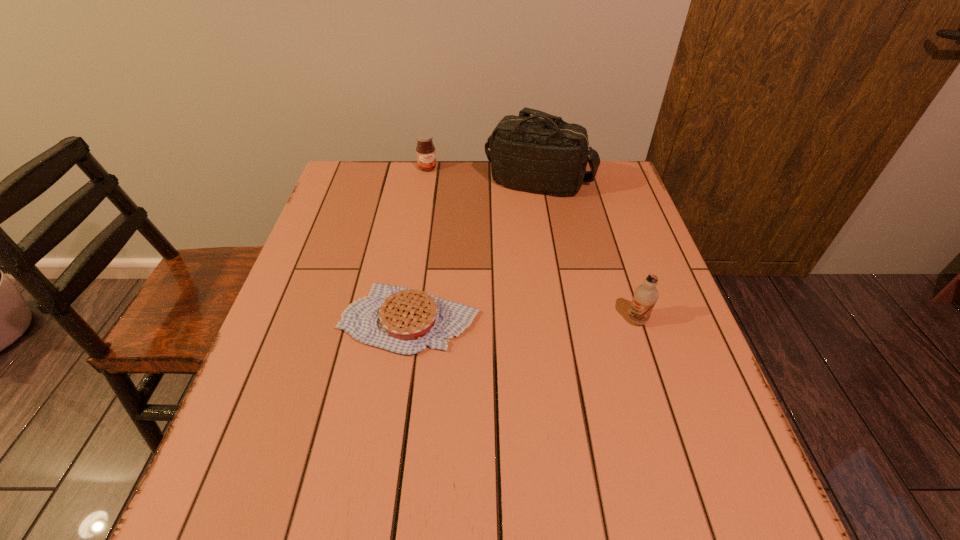
The width and height of the screenshot is (960, 540). I want to click on vacant space at the left edge of the desktop, so click(365, 228).

Identify the location of free space at the right edge of the desktop. The width and height of the screenshot is (960, 540). (618, 339).

Identify the location of free space at the near left corner of the desktop. (251, 440).

At what (x,y) coordinates should I click in order to perform the action: click on unoccupied position between the tallest object and the shortest object. Please return your answer as a coordinate pair (x, y). The width and height of the screenshot is (960, 540). Looking at the image, I should click on (474, 251).

Find the location of a particular element. The height and width of the screenshot is (540, 960). empty location between the pie and the tallest object is located at coordinates (474, 251).

The image size is (960, 540). Identify the location of free spot between the shoulder bag and the shortest object. (474, 251).

The width and height of the screenshot is (960, 540). I want to click on free spot between the pie and the third shortest object, so click(x=523, y=320).

At what (x,y) coordinates should I click in order to perform the action: click on free space between the shortest object and the third shortest object. Please return your answer as a coordinate pair (x, y). The image size is (960, 540). Looking at the image, I should click on (523, 320).

The height and width of the screenshot is (540, 960). What are the coordinates of `free space between the pie and the second shortest object` in the screenshot? It's located at (419, 244).

The image size is (960, 540). In order to click on vacant region between the third tallest object and the shoulder bag in this screenshot , I will do `click(483, 176)`.